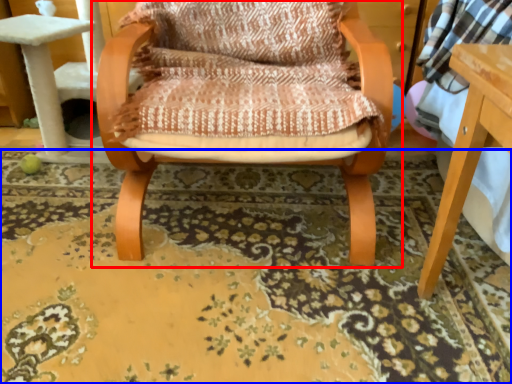
Question: Among these objects, which one is farthest to the camera, chair (highlighted by a red box) or mat (highlighted by a blue box)?

Choices:
 (A) chair
 (B) mat

Answer: (B)